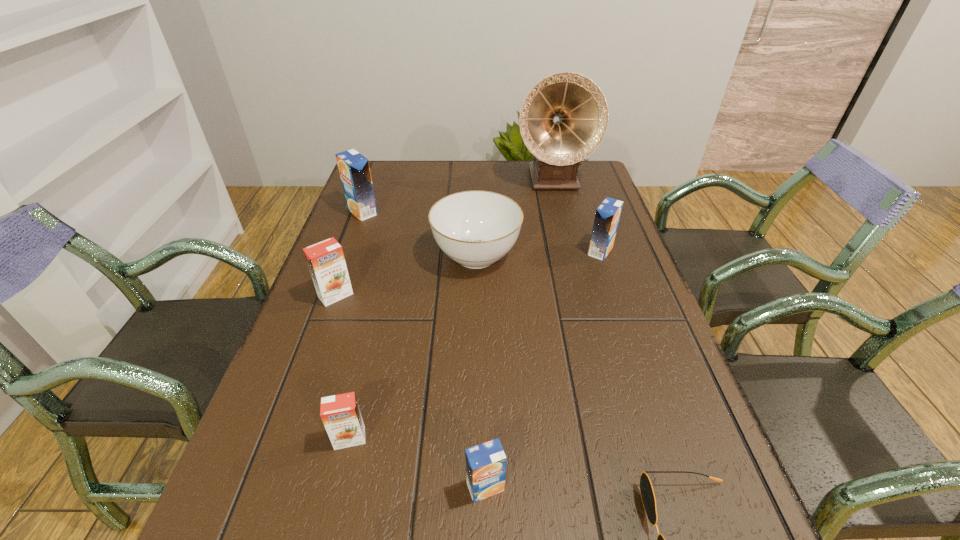
I want to click on the right orange orange juice, so click(340, 414).

This screenshot has height=540, width=960. Find the location of `the fourth orange_juice from left to right`. the fourth orange_juice from left to right is located at coordinates (485, 463).

You are a GUI agent. You are given a task and a screenshot of the screen. Output one action in this format:
    pyautogui.click(x=<x>, y=<y>)
    Task: Click on the second blue orange_juice from right to left
    This screenshot has height=540, width=960.
    Given the screenshot: What is the action you would take?
    pyautogui.click(x=485, y=463)

The width and height of the screenshot is (960, 540). In order to click on vacant space located on the horn of the farthest object in this screenshot , I will do pyautogui.click(x=566, y=233).

The width and height of the screenshot is (960, 540). In order to click on vacant space situated on the front of the biggest blue orange_juice in this screenshot , I will do `click(349, 248)`.

This screenshot has height=540, width=960. I want to click on vacant space positioned 0.180m on the back of the farther orange orange juice, so click(x=355, y=241).

The width and height of the screenshot is (960, 540). Find the location of `free space located 0.320m on the back of the second biggest blue orange_juice`. free space located 0.320m on the back of the second biggest blue orange_juice is located at coordinates (578, 185).

Image resolution: width=960 pixels, height=540 pixels. Identify the location of vacant space located 0.260m on the right of the gray chinaware. (618, 256).

Identify the location of vacant position located on the right of the second nearest orange_juice. (514, 438).

The image size is (960, 540). I want to click on free spot located on the right of the second blue orange_juice from right to left, so click(x=688, y=487).